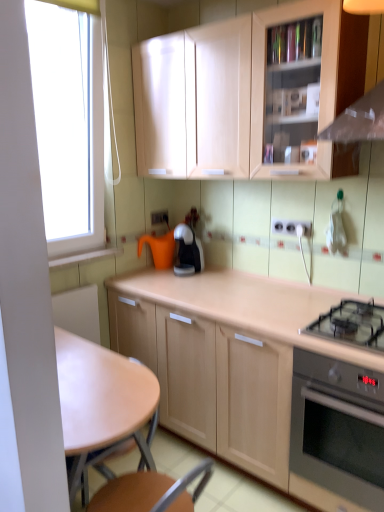
Locate an element on the screen. free space in front of black glossy coffee maker at center is located at coordinates (201, 276).